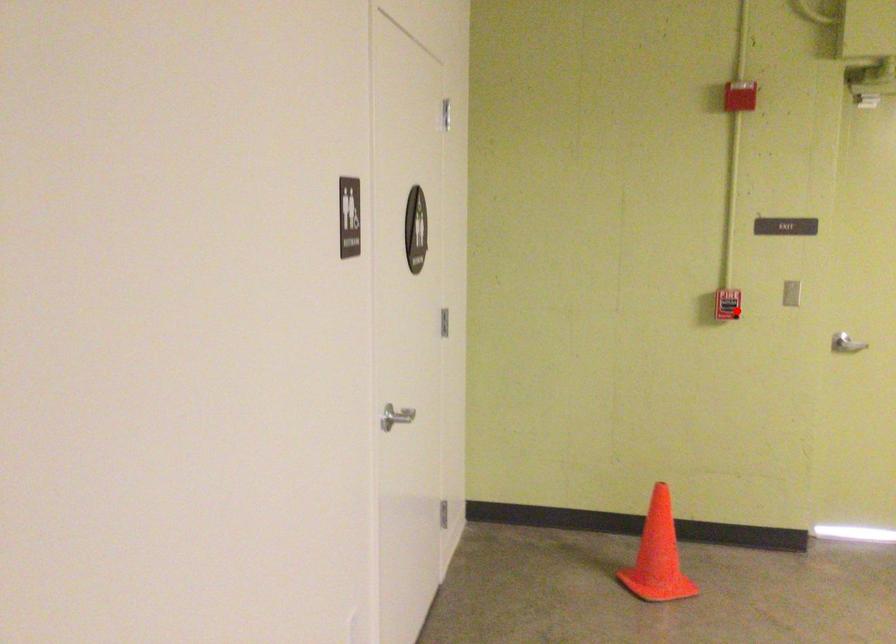
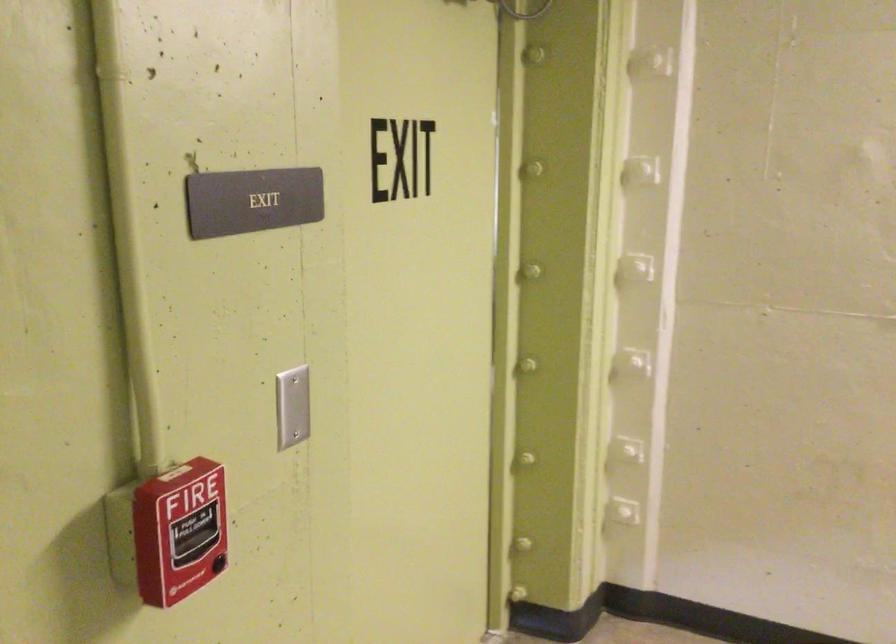
Question: I am providing you with two images of the same scene from different viewpoints. Given a red point in image1, look at the same physical point in image2. Is it:

Choices:
 (A) Closer to the viewpoint
 (B) Farther from the viewpoint

Answer: (A)